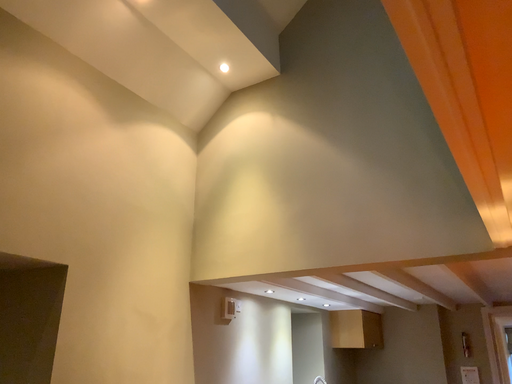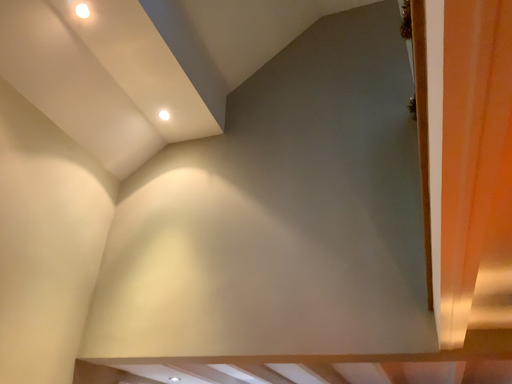
Question: How did the camera likely rotate when shooting the video?

Choices:
 (A) rotated right
 (B) rotated left

Answer: (A)